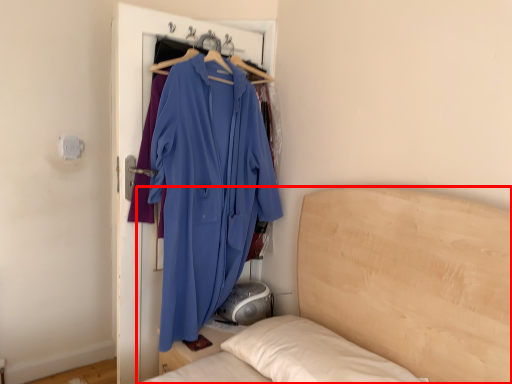
Question: From the image's perspective, where is bed (annotated by the red box) located in relation to fancy dress in the image?

Choices:
 (A) below
 (B) above

Answer: (A)